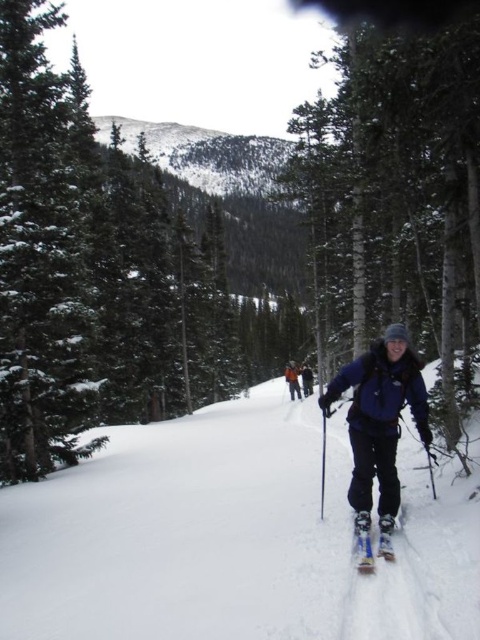
Question: Among these points, which one is nearest to the camera?

Choices:
 (A) (453, 317)
 (B) (303, 364)
 (C) (245, 451)
 (D) (369, 541)

Answer: (D)

Question: Is white snow ski slope at center to the right of smooth white snow at center from the viewer's perspective?

Choices:
 (A) yes
 (B) no

Answer: (B)

Question: Can you confirm if matte blue jacket at center is positioned to the right of orange fabric jacket at center?

Choices:
 (A) yes
 (B) no

Answer: (B)

Question: Which object appears farthest from the camera in this image?

Choices:
 (A) smooth white snow at center
 (B) white matte ski at lower center
 (C) matte blue jacket at center

Answer: (A)

Question: Considering the real-world distances, which object is closest to the white matte ski at lower center?

Choices:
 (A) smooth white snow at center
 (B) white snow ski slope at center
 (C) orange fabric jacket at center

Answer: (B)

Question: Does white matte ski at lower center have a lesser width compared to orange fabric jacket at center?

Choices:
 (A) no
 (B) yes

Answer: (B)